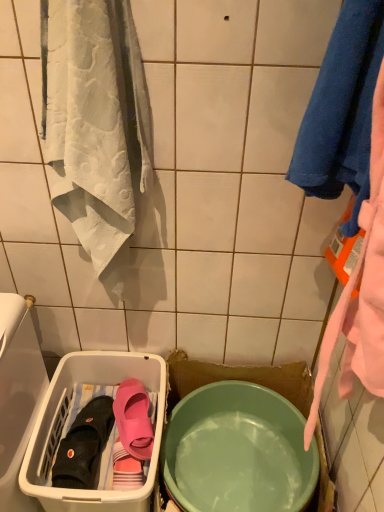
Question: Would you say pink rubber slipper at lower left, which is the 1th footwear in right-to-left order, contains white plastic laundry basket at lower left?

Choices:
 (A) no
 (B) yes

Answer: (A)

Question: Can you confirm if pink rubber slipper at lower left, which is the 1th footwear in right-to-left order, is shorter than white plastic laundry basket at lower left?

Choices:
 (A) yes
 (B) no

Answer: (A)

Question: Is pink rubber slipper at lower left, which is the 1th footwear in right-to-left order, oriented away from white plastic laundry basket at lower left?

Choices:
 (A) no
 (B) yes

Answer: (B)

Question: From the image's perspective, does pink rubber slipper at lower left, which is the 2th footwear in left-to-right order, appear higher than white plastic laundry basket at lower left?

Choices:
 (A) yes
 (B) no

Answer: (A)

Question: From a real-world perspective, is pink rubber slipper at lower left, which is the 2th footwear in left-to-right order, on top of white plastic laundry basket at lower left?

Choices:
 (A) yes
 (B) no

Answer: (A)

Question: From their relative heights in the image, would you say white plastic laundry basket at lower left is taller or shorter than matte green bowl at center?

Choices:
 (A) tall
 (B) short

Answer: (A)

Question: In terms of width, does white plastic laundry basket at lower left look wider or thinner when compared to matte green bowl at center?

Choices:
 (A) wide
 (B) thin

Answer: (A)

Question: Is point (66, 372) closer or farther from the camera than point (210, 386)?

Choices:
 (A) farther
 (B) closer

Answer: (B)

Question: Considering their positions, is white plastic laundry basket at lower left located in front of or behind matte green bowl at center?

Choices:
 (A) behind
 (B) front

Answer: (B)

Question: From a real-world perspective, is black rubber boot at lower left, the first footwear when ordered from left to right, physically located above or below pink rubber slipper at lower left, which is the 1th footwear in right-to-left order?

Choices:
 (A) below
 (B) above

Answer: (A)

Question: From their relative heights in the image, would you say black rubber boot at lower left, marked as the 2th footwear in a right-to-left arrangement, is taller or shorter than pink rubber slipper at lower left, which is the 1th footwear in right-to-left order?

Choices:
 (A) tall
 (B) short

Answer: (A)

Question: In the image, is black rubber boot at lower left, the first footwear when ordered from left to right, positioned in front of or behind pink rubber slipper at lower left, which is the 2th footwear in left-to-right order?

Choices:
 (A) behind
 (B) front

Answer: (B)

Question: Is black rubber boot at lower left, marked as the 2th footwear in a right-to-left arrangement, inside or outside of pink rubber slipper at lower left, which is the 1th footwear in right-to-left order?

Choices:
 (A) outside
 (B) inside

Answer: (A)

Question: Would you say matte green bowl at center is to the left or to the right of white plastic laundry basket at lower left in the picture?

Choices:
 (A) left
 (B) right

Answer: (B)

Question: In terms of width, does matte green bowl at center look wider or thinner when compared to white plastic laundry basket at lower left?

Choices:
 (A) wide
 (B) thin

Answer: (B)